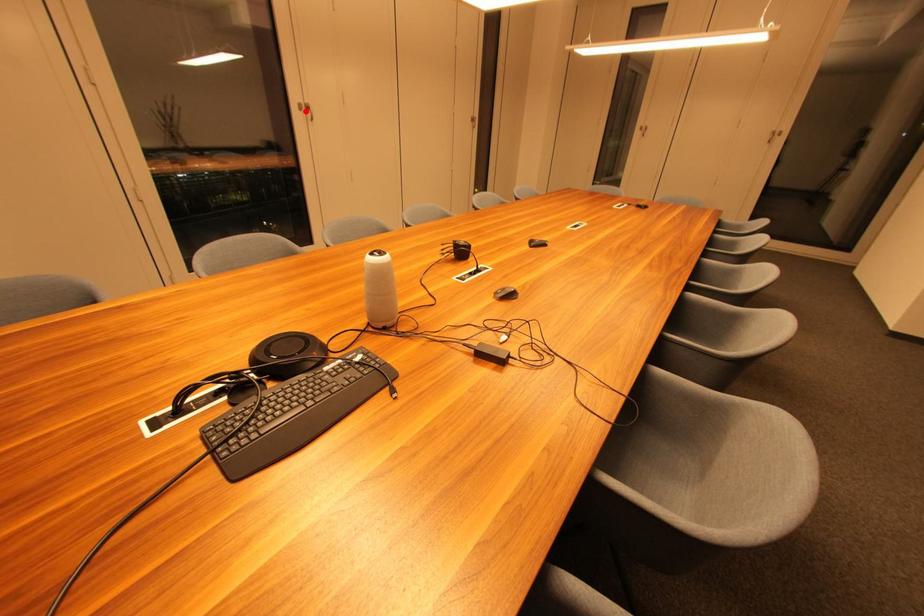
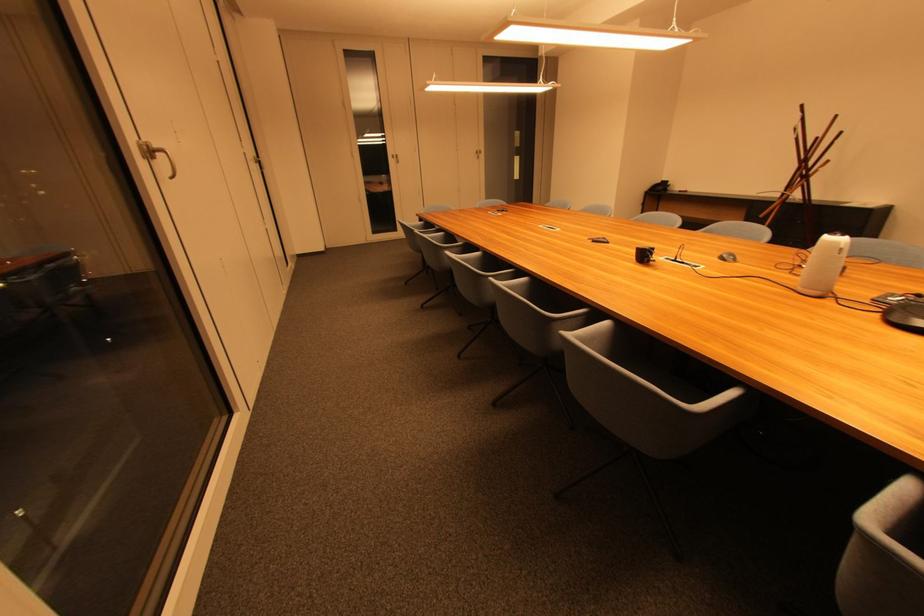
Where in the second image is the point corresponding to the highlighted location from the first image?

(148, 159)